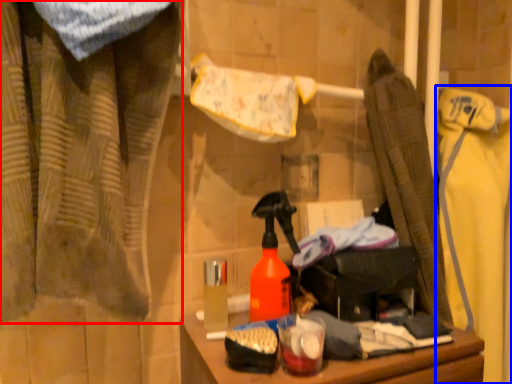
Question: Which point is closer to the camera, curtain (highlighted by a red box) or clothing (highlighted by a blue box)?

Choices:
 (A) curtain
 (B) clothing

Answer: (A)